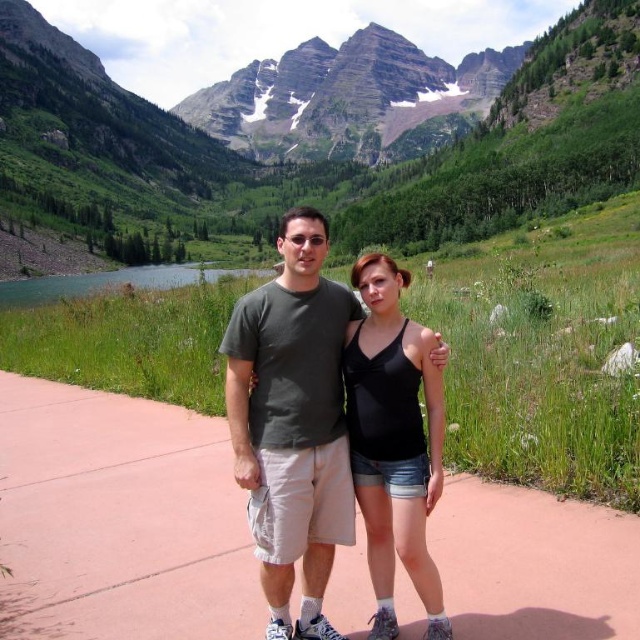
Does green grassy mountain at center have a greater width compared to pink concrete sidewalk at center?

Correct, the width of green grassy mountain at center exceeds that of pink concrete sidewalk at center.

Locate an element on the screen. This screenshot has width=640, height=640. green grassy mountain at center is located at coordinates (330, 132).

Locate an element on the screen. The height and width of the screenshot is (640, 640). green grassy mountain at center is located at coordinates (330, 132).

Does dark gray cotton t-shirt at center have a lesser height compared to black matte tank top at center?

No.

Is point (272, 372) positioned before point (353, 387)?

Yes, it is in front of point (353, 387).

What do you see at coordinates (292, 422) in the screenshot? I see `dark gray cotton t-shirt at center` at bounding box center [292, 422].

You are a GUI agent. You are given a task and a screenshot of the screen. Output one action in this format:
    pyautogui.click(x=<x>, y=<y>)
    Task: Click on the dark gray cotton t-shirt at center
    
    Given the screenshot: What is the action you would take?
    pyautogui.click(x=292, y=422)

Is green grassy mountain at center below black matte tank top at center?

Actually, green grassy mountain at center is above black matte tank top at center.

Between green grassy mountain at center and black matte tank top at center, which one appears on the left side from the viewer's perspective?

green grassy mountain at center

Is point (115, 96) farther from camera compared to point (429, 422)?

Yes, it is.

Locate an element on the screen. The width and height of the screenshot is (640, 640). green grassy mountain at center is located at coordinates (330, 132).